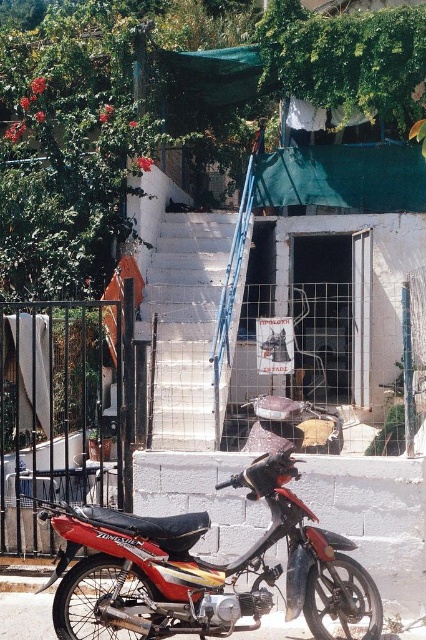
You are standing in a residential area and see the shiny red motorcycle at lower left. If you want to touch it, how many steps would you need to take if each step is about 3 feet?

The distance between you and the shiny red motorcycle at lower left is 20.33 feet. Dividing this by 3 feet per step gives approximately 6.78 steps. Since you can only take whole steps, you would need to take 7 steps to reach the shiny red motorcycle at lower left.

You are standing at the entrance of the residential area and want to take a photo of the black metal fence at left. Where should you position yourself to ensure the fence is fully visible in the frame?

The black metal fence at left is located at point (60, 412), so you should position yourself to the left side of the scene to capture the fence within the frame.

You are a delivery person trying to park your shiny red motorcycle at lower left near the black metal fence at left. Can you park it without blocking the entrance of the building?

The shiny red motorcycle at lower left is located below the black metal fence at left, so parking it there would block the entrance of the building. Please choose another spot.